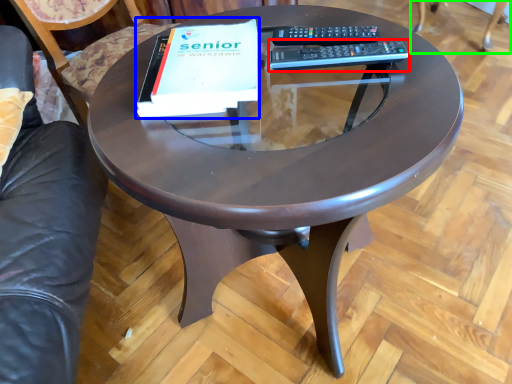
Question: Which is farther away from remote (highlighted by a red box)? paperback book (highlighted by a blue box) or swivel chair (highlighted by a green box)?

Choices:
 (A) paperback book
 (B) swivel chair

Answer: (B)